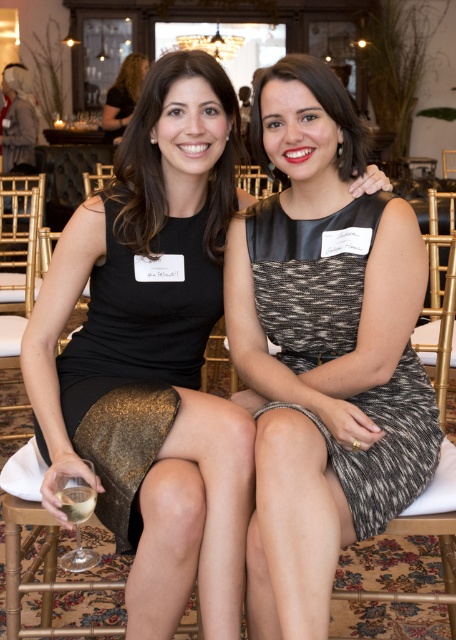
You are a photographer setting up a shot of the two women in the scene. You want to ensure that the matte black dress at center and the translucent glass at lower left are both clearly visible in the final photo. Given their sizes, which object should you focus on to ensure both are in sharp focus?

The matte black dress at center is larger than the translucent glass at lower left. To ensure both are in sharp focus, you should focus on the matte black dress at center since it is the larger object and requires more attention in the composition.

What is the color and material of the dress worn by the woman at the point with coordinates (135, 362)?

The point at (135, 362) corresponds to the black leather dress at left.